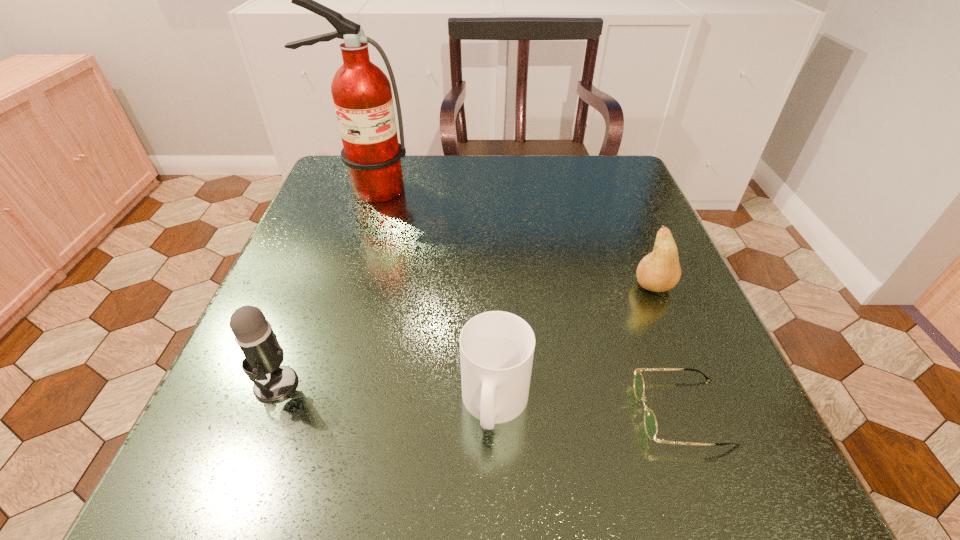
In order to click on vacant point located between the shortest object and the third object from left to right in this screenshot , I will do `click(588, 408)`.

Identify the location of free space between the pear and the third object from left to right. (575, 345).

You are a GUI agent. You are given a task and a screenshot of the screen. Output one action in this format:
    pyautogui.click(x=<x>, y=<y>)
    Task: Click on the empty location between the microphone and the mug
    
    Given the screenshot: What is the action you would take?
    pyautogui.click(x=386, y=394)

Identify the location of unoccupied position between the fourth shortest object and the tallest object. (322, 286).

The width and height of the screenshot is (960, 540). What are the coordinates of `free space between the farthest object and the shortest object` in the screenshot? It's located at (524, 300).

Where is `free spot between the farthest object and the fourth shortest object`? This screenshot has height=540, width=960. free spot between the farthest object and the fourth shortest object is located at coordinates (322, 286).

At what (x,y) coordinates should I click in order to perform the action: click on free space between the farthest object and the third object from right to left. Please return your answer as a coordinate pair (x, y). This screenshot has width=960, height=540. Looking at the image, I should click on (431, 296).

Identify which object is located as the fourth nearest to the fourth nearest object. Please provide its 2D coordinates. Your answer should be formatted as a tuple, i.e. [(x, y)], where the tuple contains the x and y coordinates of a point satisfying the conditions above.

[(254, 335)]

The image size is (960, 540). I want to click on object that is the third nearest to the fourth shortest object, so click(x=650, y=422).

This screenshot has height=540, width=960. Find the location of `vacant space that satisfies the following two spatial constraints: 1. on the nozzle and handle of the fourth nearest object; 2. on the right side of the farthest object`. vacant space that satisfies the following two spatial constraints: 1. on the nozzle and handle of the fourth nearest object; 2. on the right side of the farthest object is located at coordinates (333, 286).